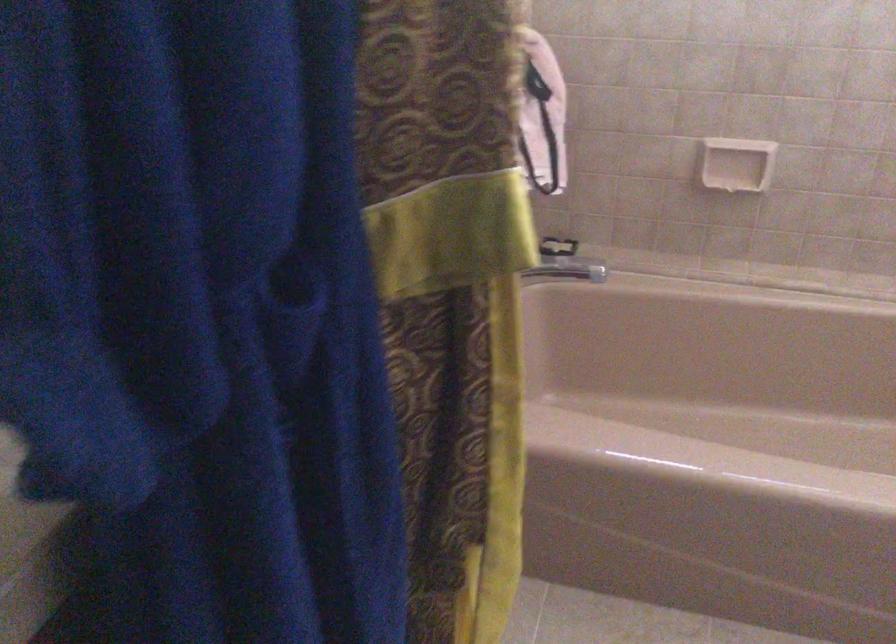
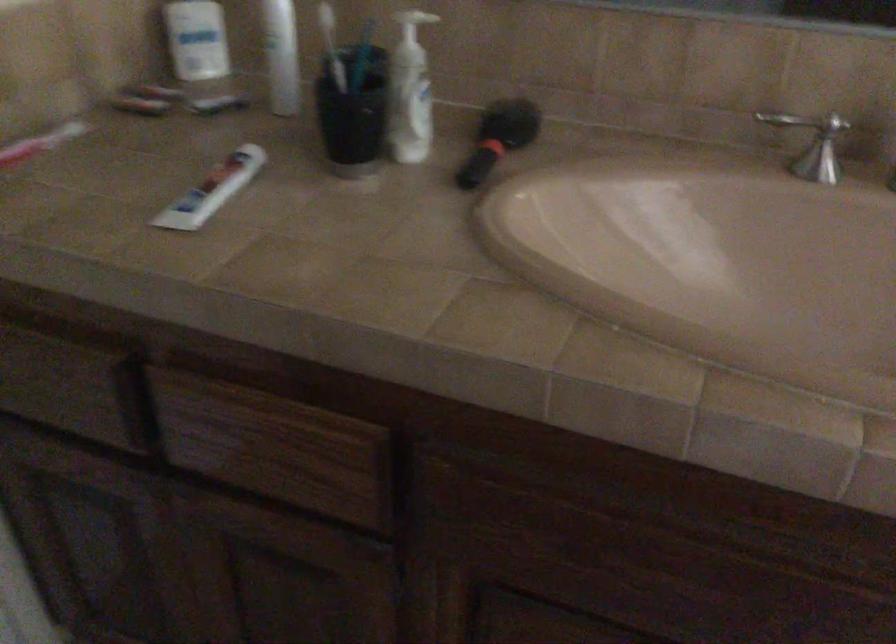
Based on the continuous images, in which direction is the camera rotating?

The camera's rotation is toward left-down.